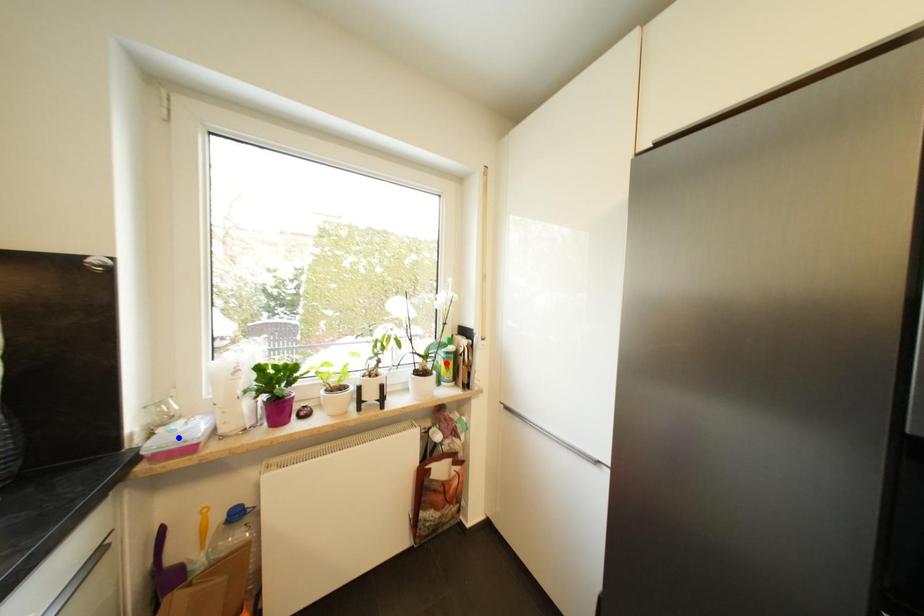
Question: Which of the two points in the image is closer to the camera?

Choices:
 (A) Blue point is closer.
 (B) Red point is closer.

Answer: (A)